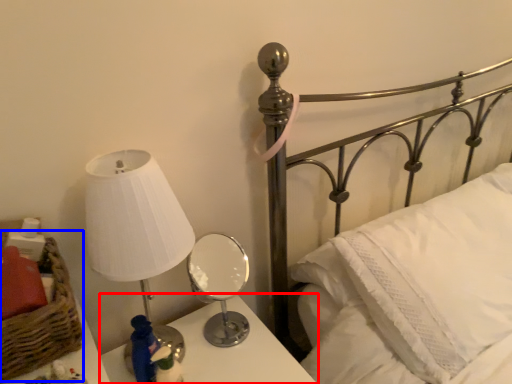
Question: Which object appears farthest to the camera in this image, nightstand (highlighted by a red box) or basket (highlighted by a blue box)?

Choices:
 (A) nightstand
 (B) basket

Answer: (A)